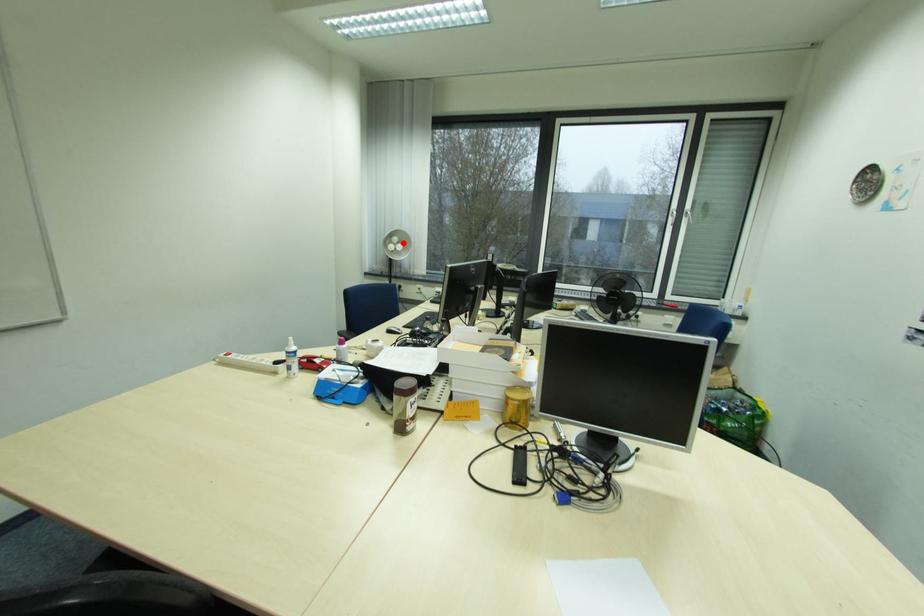
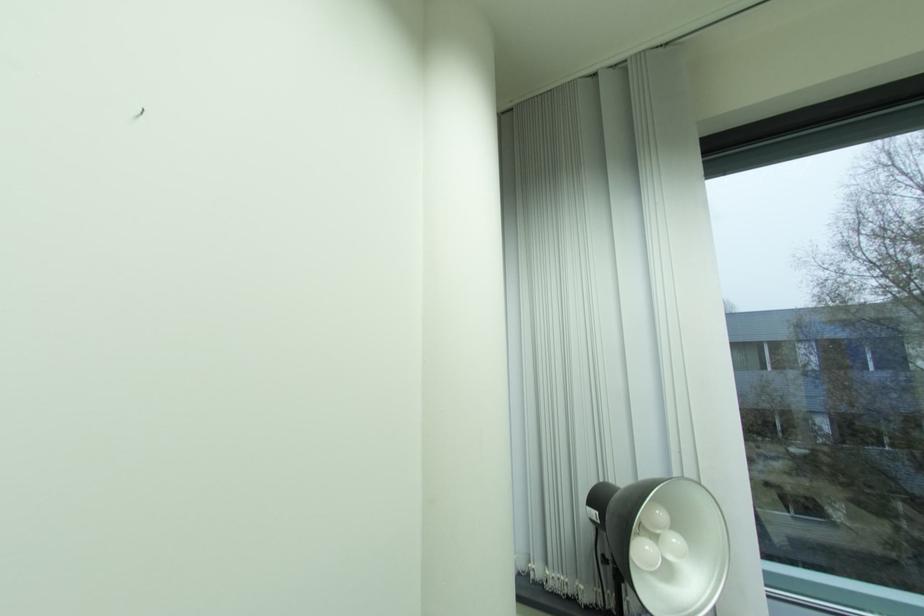
Where in the second image is the point corresponding to the highlighted location from the first image?

(665, 531)